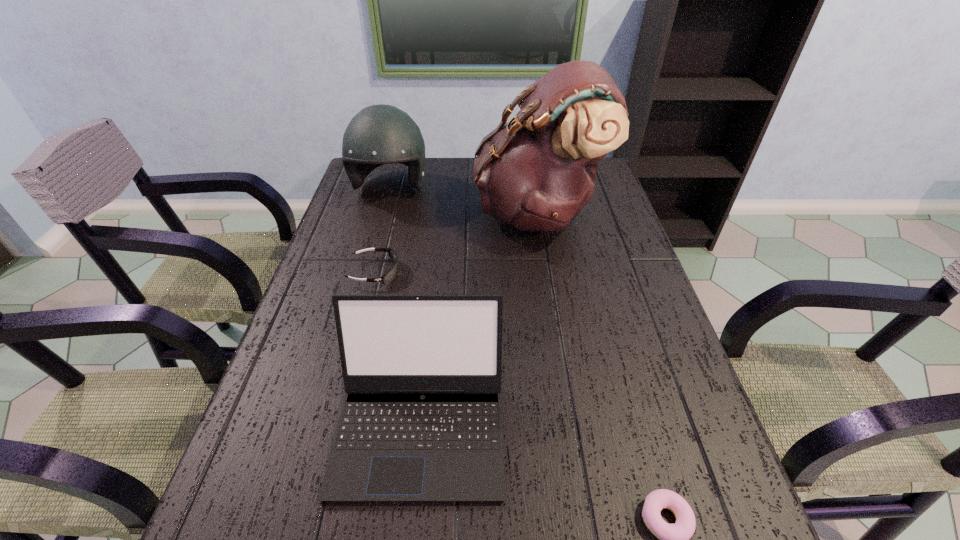
This screenshot has height=540, width=960. Find the location of `free space at the left edge of the desktop`. free space at the left edge of the desktop is located at coordinates (333, 328).

In the image, there is a desktop. Where is `free space at the right edge`? This screenshot has width=960, height=540. free space at the right edge is located at coordinates (647, 422).

At what (x,y) coordinates should I click in order to perform the action: click on free point between the fourth tallest object and the fourth shortest object. Please return your answer as a coordinate pair (x, y). Looking at the image, I should click on (383, 231).

Find the location of `free area in between the goggles and the football helmet`. free area in between the goggles and the football helmet is located at coordinates (383, 231).

Find the location of a particular element. unoccupied area between the goggles and the football helmet is located at coordinates (383, 231).

The image size is (960, 540). I want to click on unoccupied area between the fourth tallest object and the satchel, so click(x=456, y=242).

Identify which object is the closest to the fourth shortest object. Please provide its 2D coordinates. Your answer should be formatted as a tuple, i.e. [(x, y)], where the tuple contains the x and y coordinates of a point satisfying the conditions above.

[(536, 173)]

I want to click on the third closest object relative to the satchel, so click(x=421, y=420).

Where is `blank space that satisfies the following two spatial constraints: 1. at the front of the tallest object with buckles; 2. on the surface of the laptop`? This screenshot has height=540, width=960. blank space that satisfies the following two spatial constraints: 1. at the front of the tallest object with buckles; 2. on the surface of the laptop is located at coordinates (571, 426).